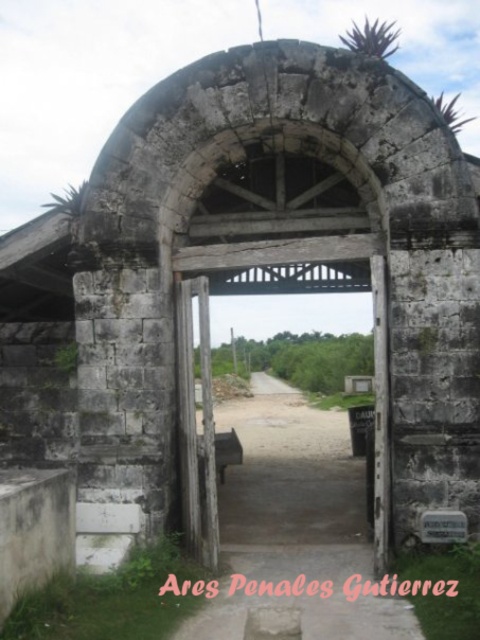
Question: Which point is farther to the camera?

Choices:
 (A) (287, 442)
 (B) (192, 362)

Answer: (A)

Question: Is dirt/gravel path at center positioned before weathered wood gate at center?

Choices:
 (A) no
 (B) yes

Answer: (B)

Question: Does dirt/gravel path at center have a greater width compared to weathered wood gate at center?

Choices:
 (A) yes
 (B) no

Answer: (B)

Question: Which point is closer to the camera taking this photo?

Choices:
 (A) (241, 477)
 (B) (380, 504)

Answer: (B)

Question: Can you confirm if dirt/gravel path at center is smaller than weathered wood gate at center?

Choices:
 (A) no
 (B) yes

Answer: (B)